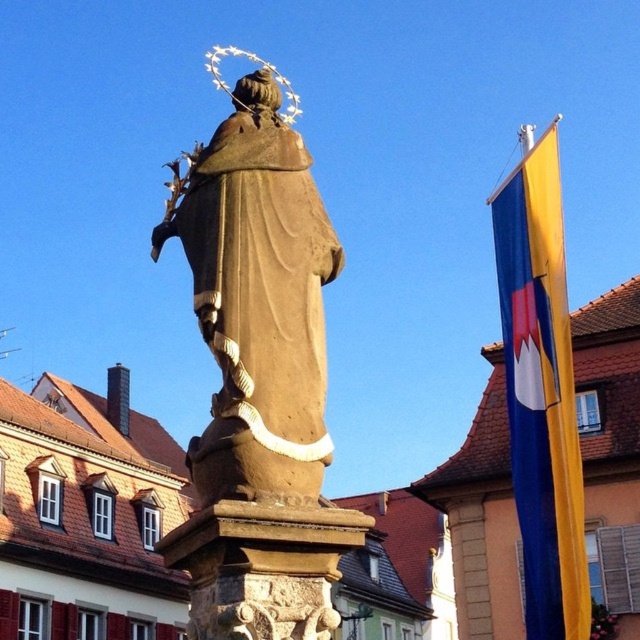
Does point (227, 196) come closer to viewer compared to point (556, 611)?

Yes, point (227, 196) is closer to viewer.

Does brown stone statue at center have a lesser width compared to yellow fabric flag at right?

Yes, brown stone statue at center is thinner than yellow fabric flag at right.

Measure the distance between point (x=244, y=380) and camera.

Point (x=244, y=380) is 14.43 meters from camera.

The image size is (640, 640). Identify the location of brown stone statue at center. click(259, 378).